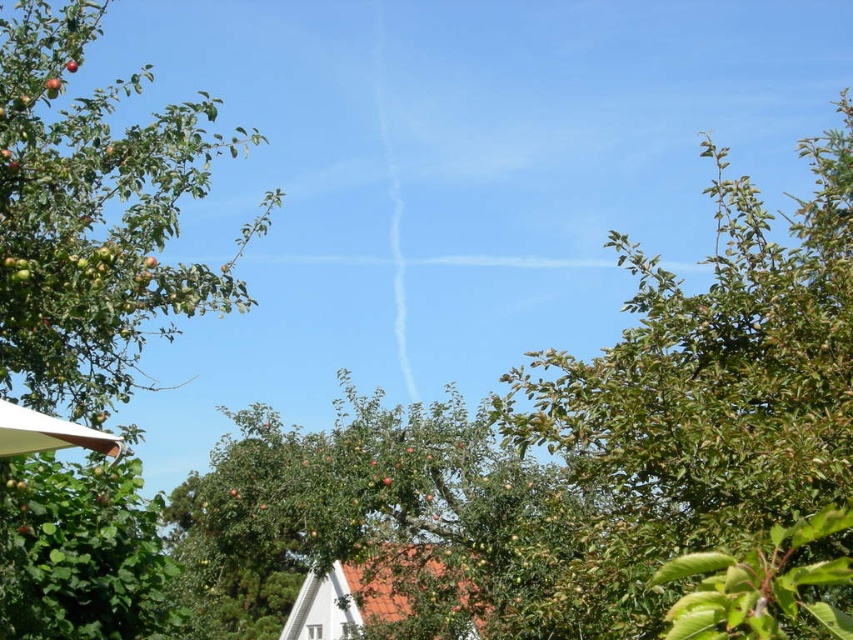
Which is more to the left, ripe red apple at upper left or ripe red apple at center?

ripe red apple at center

I want to click on ripe red apple at upper left, so click(51, 83).

Where is `ripe red apple at upper left`? This screenshot has width=853, height=640. ripe red apple at upper left is located at coordinates (51, 83).

Which is behind, point (701, 332) or point (53, 77)?

Point (53, 77)

At what (x,y) coordinates should I click in order to perform the action: click on green leafy tree at upper right. Please return your answer as a coordinate pair (x, y). Looking at the image, I should click on (705, 396).

Image resolution: width=853 pixels, height=640 pixels. Find the location of `green leafy tree at upper right`. green leafy tree at upper right is located at coordinates (705, 396).

Can you confirm if green leafy tree at upper right is positioned below ripe red apple at center?

Indeed, green leafy tree at upper right is positioned under ripe red apple at center.

Does green leafy tree at upper right have a smaller size compared to ripe red apple at center?

Actually, green leafy tree at upper right might be larger than ripe red apple at center.

This screenshot has height=640, width=853. What do you see at coordinates (705, 396) in the screenshot?
I see `green leafy tree at upper right` at bounding box center [705, 396].

The height and width of the screenshot is (640, 853). In order to click on green leafy tree at upper right in this screenshot , I will do `click(705, 396)`.